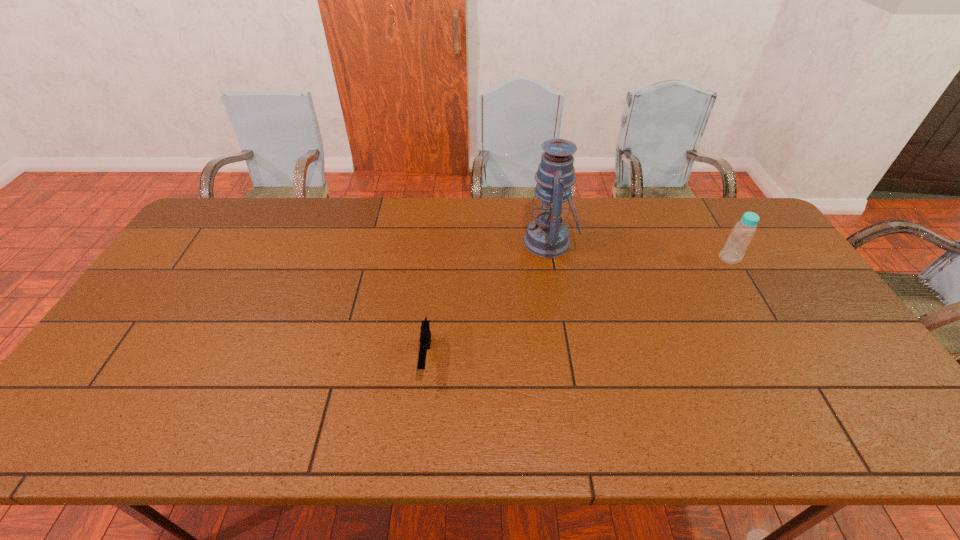
At what (x,y) coordinates should I click in order to perform the action: click on vacant space located on the front-facing side of the nearest object. Please return your answer as a coordinate pair (x, y). This screenshot has height=540, width=960. Looking at the image, I should click on (418, 442).

The width and height of the screenshot is (960, 540). In order to click on object positioned at the far edge in this screenshot , I will do `click(547, 236)`.

You are a GUI agent. You are given a task and a screenshot of the screen. Output one action in this format:
    pyautogui.click(x=<x>, y=<y>)
    Task: Click on the object located in the right edge section of the desktop
    
    Given the screenshot: What is the action you would take?
    pyautogui.click(x=744, y=230)

Where is `vacant space at the far edge of the desktop`? This screenshot has height=540, width=960. vacant space at the far edge of the desktop is located at coordinates (621, 200).

The image size is (960, 540). In the image, there is a desktop. In order to click on free space at the near edge in this screenshot , I will do `click(396, 432)`.

In the image, there is a desktop. In order to click on blank space at the left edge in this screenshot , I will do click(x=168, y=272).

The height and width of the screenshot is (540, 960). I want to click on free space at the right edge, so click(826, 310).

This screenshot has height=540, width=960. What are the coordinates of `vacant region at the far right corner of the desktop` in the screenshot? It's located at (699, 198).

This screenshot has height=540, width=960. Find the location of `empty space that is in between the bottle and the pistol`. empty space that is in between the bottle and the pistol is located at coordinates (578, 308).

I want to click on vacant area that lies between the nearest object and the rightmost object, so click(578, 308).